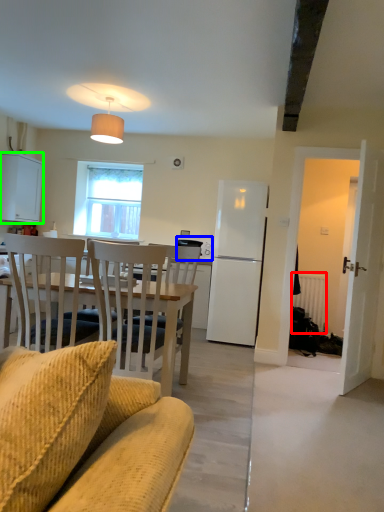
Question: Which object is the closest to the radiator (highlighted by a red box)? Choose among these: microwave oven (highlighted by a blue box) or cabinetry (highlighted by a green box).

Choices:
 (A) microwave oven
 (B) cabinetry

Answer: (A)